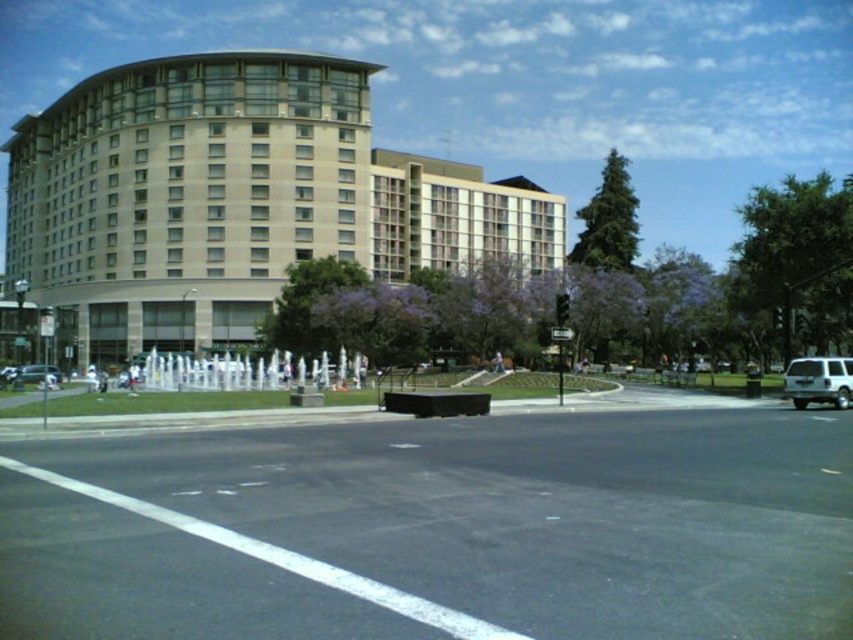
Question: Which object appears closest to the camera in this image?

Choices:
 (A) beige glass building at upper left
 (B) white matte suv at right
 (C) silver metallic sedan at lower left

Answer: (B)

Question: From the image, what is the correct spatial relationship of beige glass building at upper left in relation to white matte suv at right?

Choices:
 (A) below
 (B) above

Answer: (B)

Question: From the image, what is the correct spatial relationship of beige glass building at upper left in relation to white matte suv at right?

Choices:
 (A) above
 (B) below

Answer: (A)

Question: Which point is farther to the camera?

Choices:
 (A) (6, 376)
 (B) (430, 204)
 (C) (828, 372)

Answer: (B)

Question: Where is white matte suv at right located in relation to silver metallic sedan at lower left in the image?

Choices:
 (A) below
 (B) above

Answer: (B)

Question: Considering the real-world distances, which object is closest to the white matte suv at right?

Choices:
 (A) beige glass building at upper left
 (B) silver metallic sedan at lower left

Answer: (B)